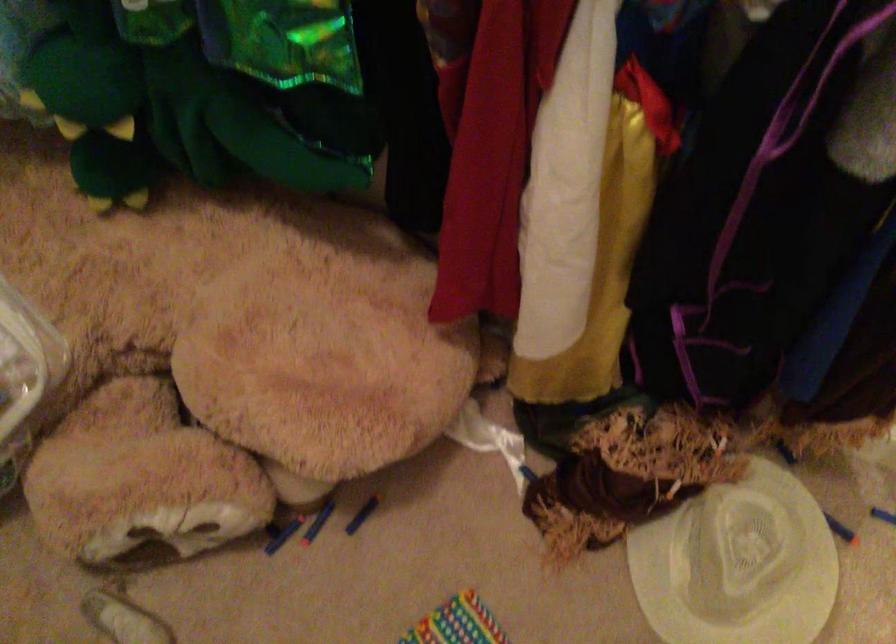
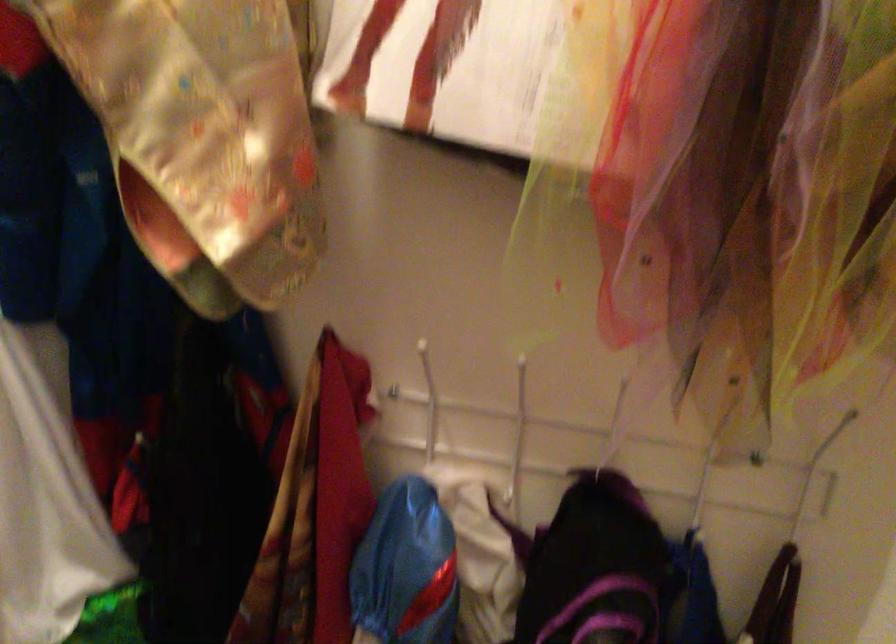
How did the camera likely rotate?

The camera's rotation is toward right-up.